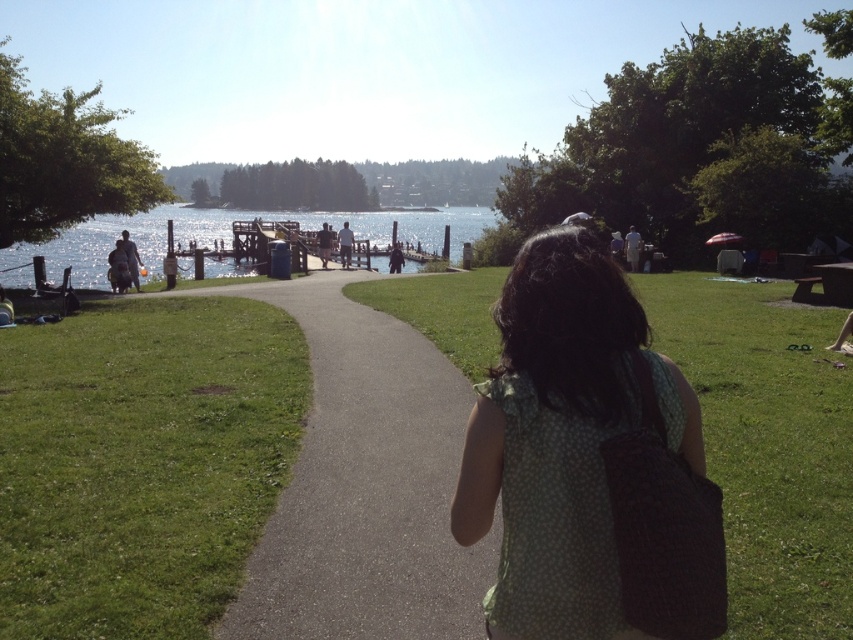
You are a photographer standing at the lakeside and want to take a photo of both the green dotted dress at center and the white cotton shirt at center. Which one is located closer to the front of the image?

The green dotted dress at center is positioned under the white cotton shirt at center, so the green dotted dress at center is closer to the front of the image.

You are standing at the lakeside and see a woman walking towards the lake carrying a dark gray fabric bag at left and wearing a white cotton shirt at center. Which item is positioned more to the left?

The dark gray fabric bag at left is positioned more to the left than the white cotton shirt at center.

You are standing at the lakeside and see a dark gray fabric bag at left and a white cotton shirt at center. Which object is positioned lower in the scene?

The dark gray fabric bag at left is located below the white cotton shirt at center, so it is positioned lower in the scene.